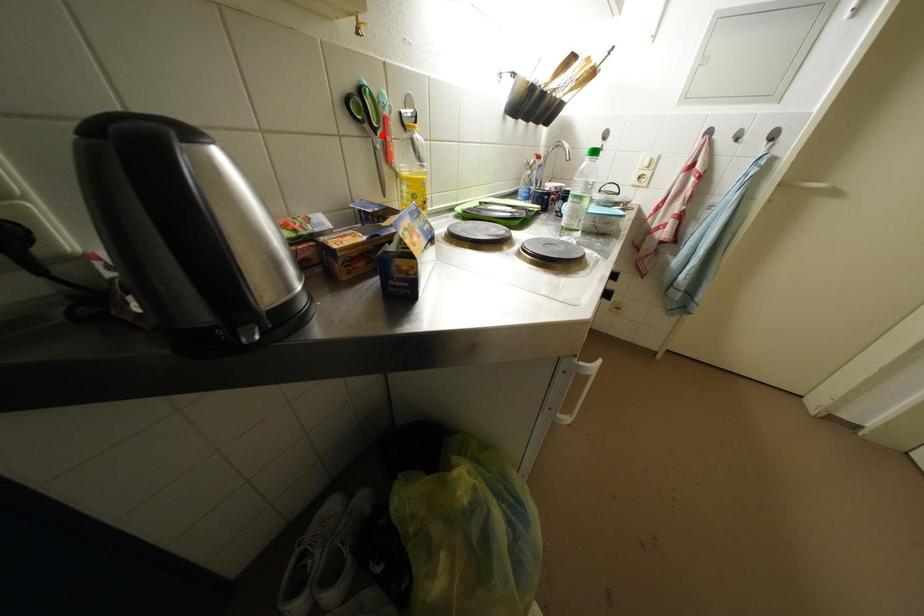
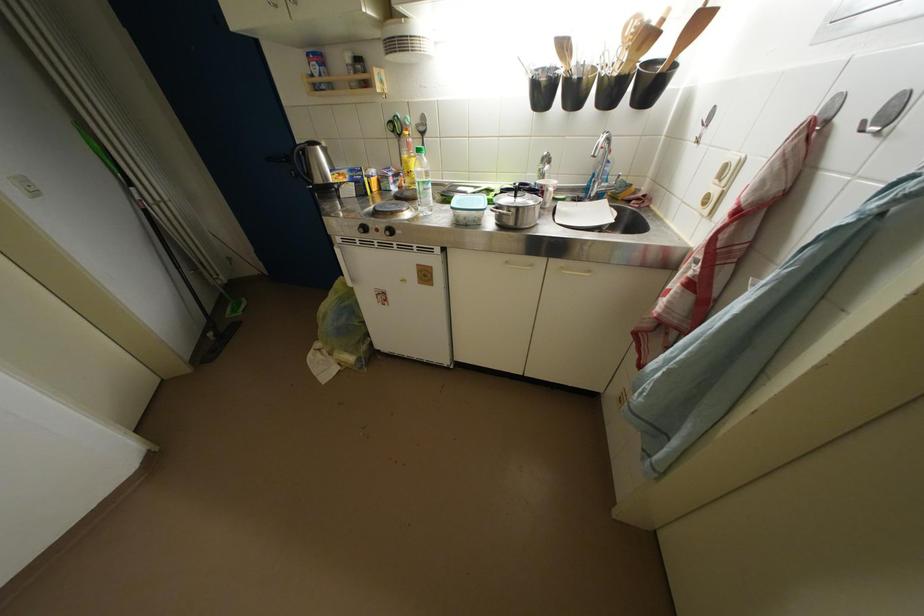
In the second image, find the point that corresponds to the highlighted location in the first image.

(407, 140)